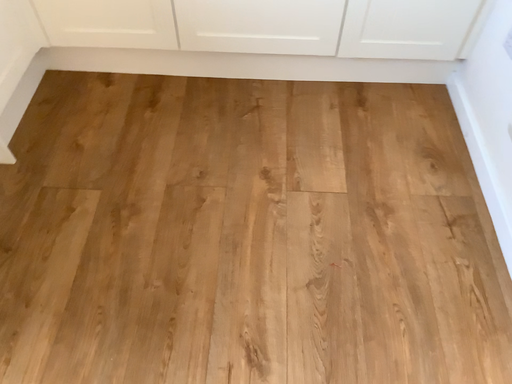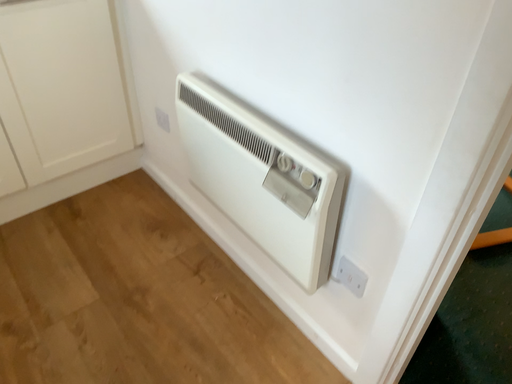
Question: How did the camera likely rotate when shooting the video?

Choices:
 (A) rotated left
 (B) rotated right

Answer: (B)